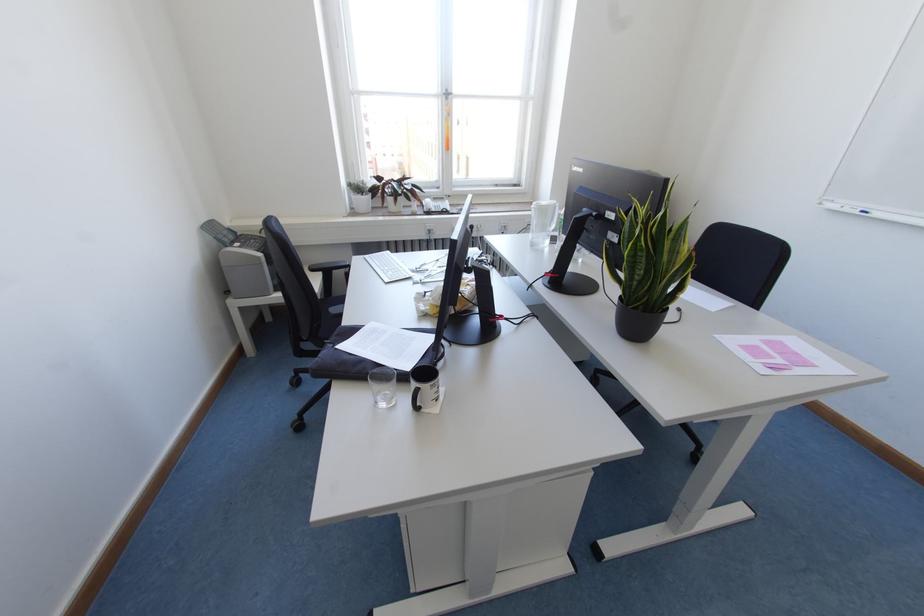
Which object does [852,209] point to?

It refers to a blue whiteboard marker.